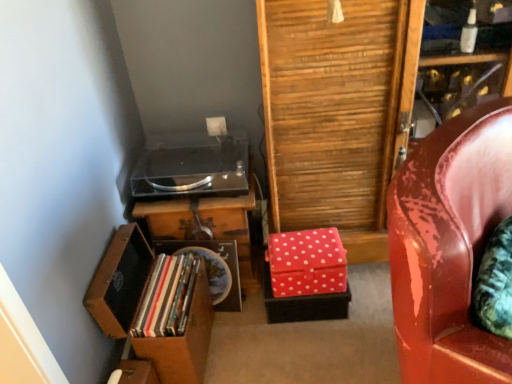
I want to click on free spot above matte plastic books at lower left (from a real-world perspective), so click(x=163, y=289).